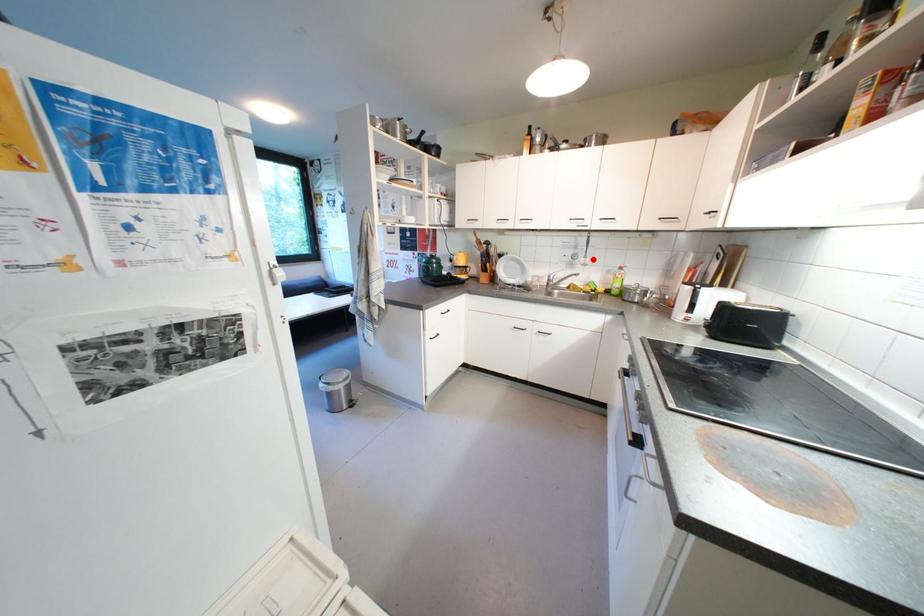
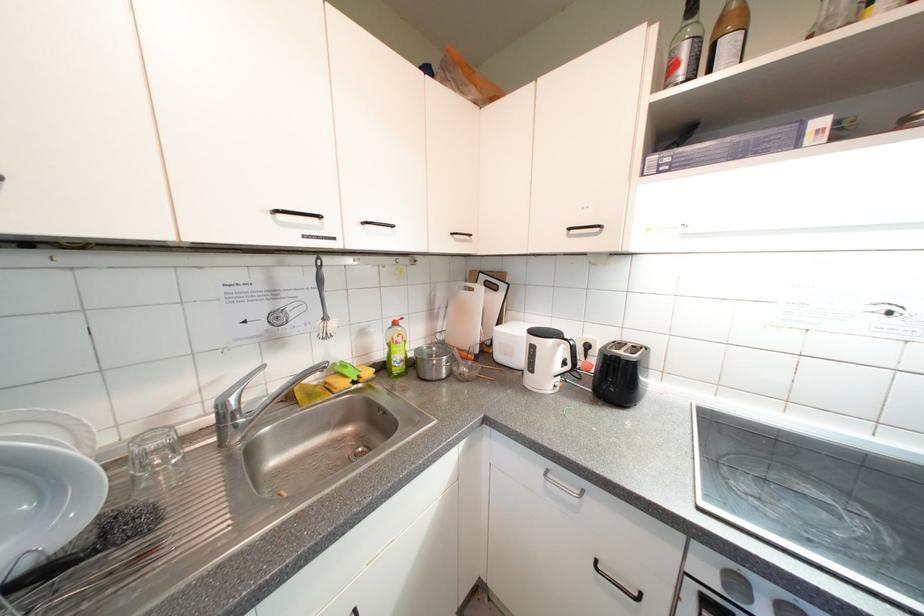
Where in the second image is the point corresponding to the highlighted location from the first image?

(333, 321)